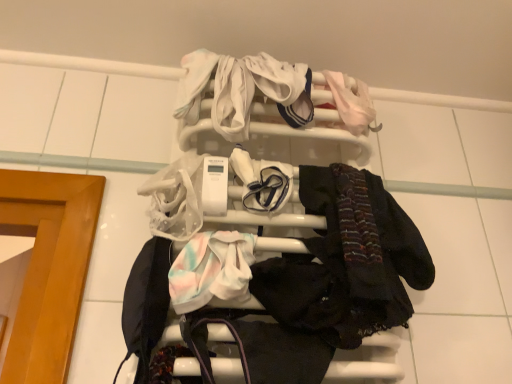
How much space does white soft fabric at center, the 2th baby clothe when ordered from left to right, occupy vertically?

The height of white soft fabric at center, the 2th baby clothe when ordered from left to right, is 4.92 inches.

What is the approximate height of dark matte scarf at center right?

11.28 inches.

Identify the location of dark matte scarf at center right. (358, 255).

Identify the location of pastel tie-dye fabric at center, placed as the first baby clothe when sorted from left to right. (212, 269).

You are a GUI agent. You are given a task and a screenshot of the screen. Output one action in this format:
    pyautogui.click(x=<x>, y=<y>)
    Task: Click on the pale pink fabric at upper right, the third baby clothe from the left
    
    Given the screenshot: What is the action you would take?
    pyautogui.click(x=350, y=102)

Does point (272, 183) come farther from viewer compared to point (361, 90)?

No, (272, 183) is closer to viewer.

Is white soft fabric at center, which is the 2th baby clothe in top-to-bottom order, taller than pale pink fabric at upper right, arranged as the first baby clothe when viewed from the back?

No, white soft fabric at center, which is the 2th baby clothe in top-to-bottom order, is not taller than pale pink fabric at upper right, arranged as the first baby clothe when viewed from the back.

Is white soft fabric at center, which is the 2th baby clothe in top-to-bottom order, thinner than pale pink fabric at upper right, arranged as the first baby clothe when viewed from the back?

Yes, white soft fabric at center, which is the 2th baby clothe in top-to-bottom order, is thinner than pale pink fabric at upper right, arranged as the first baby clothe when viewed from the back.

Looking at their sizes, would you say pale pink fabric at upper right, the third baby clothe from the left, is wider or thinner than dark matte scarf at center right?

In the image, pale pink fabric at upper right, the third baby clothe from the left, appears to be more narrow than dark matte scarf at center right.

Is pale pink fabric at upper right, the third baby clothe from the left, turned away from dark matte scarf at center right?

No, pale pink fabric at upper right, the third baby clothe from the left, is not facing the opposite direction of dark matte scarf at center right.

Is pale pink fabric at upper right, which appears as the third baby clothe when ordered from the bottom, taller than dark matte scarf at center right?

In fact, pale pink fabric at upper right, which appears as the third baby clothe when ordered from the bottom, may be shorter than dark matte scarf at center right.

From the image's perspective, who appears lower, white plastic towel rack at upper center or pale pink fabric at upper right, which appears as the third baby clothe when ordered from the bottom?

white plastic towel rack at upper center.

How many degrees apart are the facing directions of white plastic towel rack at upper center and pale pink fabric at upper right, the 3th baby clothe when ordered from front to back?

0.000335 degrees.

Could you measure the distance between white plastic towel rack at upper center and pale pink fabric at upper right, the third baby clothe from the left?

white plastic towel rack at upper center and pale pink fabric at upper right, the third baby clothe from the left, are 9.69 inches apart from each other.

Is white plastic towel rack at upper center positioned with its back to pale pink fabric at upper right, the 3th baby clothe when ordered from front to back?

Yes, white plastic towel rack at upper center is facing away from pale pink fabric at upper right, the 3th baby clothe when ordered from front to back.

In terms of height, does pastel tie-dye fabric at center, the 1th baby clothe from the front, look taller or shorter compared to white soft fabric at center, which is the 2th baby clothe in top-to-bottom order?

pastel tie-dye fabric at center, the 1th baby clothe from the front, is shorter than white soft fabric at center, which is the 2th baby clothe in top-to-bottom order.

Can you tell me how much pastel tie-dye fabric at center, the third baby clothe in the right-to-left sequence, and white soft fabric at center, the 2th baby clothe when ordered from left to right, differ in facing direction?

pastel tie-dye fabric at center, the third baby clothe in the right-to-left sequence, and white soft fabric at center, the 2th baby clothe when ordered from left to right, are facing 7.3e-05 degrees away from each other.

From the image's perspective, would you say pastel tie-dye fabric at center, marked as the first baby clothe in a bottom-to-top arrangement, is positioned over white soft fabric at center, acting as the 2th baby clothe starting from the right?

Incorrect, from the image's perspective, pastel tie-dye fabric at center, marked as the first baby clothe in a bottom-to-top arrangement, is lower than white soft fabric at center, acting as the 2th baby clothe starting from the right.

Between pastel tie-dye fabric at center, the 3th baby clothe viewed from the top, and white soft fabric at center, which appears as the second baby clothe when viewed from the front, which one has smaller width?

white soft fabric at center, which appears as the second baby clothe when viewed from the front.

From the image's perspective, is dark matte scarf at center right beneath white plastic towel rack at upper center?

Yes.

From a real-world perspective, is dark matte scarf at center right over white plastic towel rack at upper center?

No.

Is dark matte scarf at center right next to white plastic towel rack at upper center?

Yes, dark matte scarf at center right is with white plastic towel rack at upper center.

Who is bigger, dark matte scarf at center right or white plastic towel rack at upper center?

Bigger between the two is white plastic towel rack at upper center.

Is pale pink fabric at upper right, arranged as the first baby clothe when viewed from the back, taller than white soft fabric at center, which is the 2th baby clothe in top-to-bottom order?

Correct, pale pink fabric at upper right, arranged as the first baby clothe when viewed from the back, is much taller as white soft fabric at center, which is the 2th baby clothe in top-to-bottom order.

Where is `baby clothe above the white soft fabric at center, the 2th baby clothe from the bottom (from the image's perspective)`? This screenshot has width=512, height=384. baby clothe above the white soft fabric at center, the 2th baby clothe from the bottom (from the image's perspective) is located at coordinates (350, 102).

Looking at this image, which point is more forward, (347, 94) or (251, 163)?

The point (251, 163) is more forward.

Can you tell me how much pale pink fabric at upper right, the first baby clothe in the right-to-left sequence, and white soft fabric at center, the 2th baby clothe when ordered from left to right, differ in facing direction?

They differ by 9.13e-05 degrees in their facing directions.

Is point (187, 172) closer or farther from the camera than point (232, 241)?

Point (187, 172) appears to be farther away from the viewer than point (232, 241).

Is pastel tie-dye fabric at center, the third baby clothe in the right-to-left sequence, at the back of white plastic towel rack at upper center?

Absolutely, white plastic towel rack at upper center is directed away from pastel tie-dye fabric at center, the third baby clothe in the right-to-left sequence.

Which is more to the left, white plastic towel rack at upper center or pastel tie-dye fabric at center, marked as the first baby clothe in a bottom-to-top arrangement?

pastel tie-dye fabric at center, marked as the first baby clothe in a bottom-to-top arrangement.

Which is correct: white plastic towel rack at upper center is inside pastel tie-dye fabric at center, the 3th baby clothe viewed from the top, or outside of it?

white plastic towel rack at upper center lies outside pastel tie-dye fabric at center, the 3th baby clothe viewed from the top.

This screenshot has width=512, height=384. In order to click on baby clothe that is the 1st object to the left of the pale pink fabric at upper right, arranged as the first baby clothe when viewed from the back, starting at the anchor in this screenshot , I will do `click(262, 182)`.

The height and width of the screenshot is (384, 512). Identify the location of clothing in front of the pale pink fabric at upper right, the first baby clothe in the right-to-left sequence. (358, 255).

From the image, which object appears to be nearer to dark matte scarf at center right, white plastic towel rack at upper center or pastel tie-dye fabric at center, the third baby clothe in the right-to-left sequence?

The object closer to dark matte scarf at center right is white plastic towel rack at upper center.

When comparing their distances from dark matte scarf at center right, does pale pink fabric at upper right, the first baby clothe in the right-to-left sequence, or white plastic towel rack at upper center seem further?

pale pink fabric at upper right, the first baby clothe in the right-to-left sequence, is further to dark matte scarf at center right.

From the image, which object appears to be nearer to white soft fabric at center, which appears as the second baby clothe when viewed from the front, pale pink fabric at upper right, which appears as the third baby clothe when ordered from the bottom, or dark matte scarf at center right?

dark matte scarf at center right is positioned closer to the anchor white soft fabric at center, which appears as the second baby clothe when viewed from the front.

Estimate the real-world distances between objects in this image. Which object is further from white plastic towel rack at upper center, pastel tie-dye fabric at center, the third baby clothe in the right-to-left sequence, or white soft fabric at center, acting as the 2th baby clothe starting from the right?

Based on the image, white soft fabric at center, acting as the 2th baby clothe starting from the right, appears to be further to white plastic towel rack at upper center.

Which object lies further to the anchor point pastel tie-dye fabric at center, the 3th baby clothe viewed from the top, white soft fabric at center, the 2th baby clothe when ordered from left to right, or dark matte scarf at center right?

dark matte scarf at center right is further to pastel tie-dye fabric at center, the 3th baby clothe viewed from the top.

Which object lies further to the anchor point white plastic towel rack at upper center, pale pink fabric at upper right, the first baby clothe in the right-to-left sequence, or pastel tie-dye fabric at center, placed as the first baby clothe when sorted from left to right?

pale pink fabric at upper right, the first baby clothe in the right-to-left sequence, is further to white plastic towel rack at upper center.

Considering their positions, is white plastic towel rack at upper center positioned further to dark matte scarf at center right than white soft fabric at center, which appears as the second baby clothe when viewed from the front?

white soft fabric at center, which appears as the second baby clothe when viewed from the front, lies further to dark matte scarf at center right than the other object.

When comparing their distances from pastel tie-dye fabric at center, the 3th baby clothe viewed from the top, does white soft fabric at center, which is the 2th baby clothe in top-to-bottom order, or white plastic towel rack at upper center seem closer?

white soft fabric at center, which is the 2th baby clothe in top-to-bottom order, is positioned closer to the anchor pastel tie-dye fabric at center, the 3th baby clothe viewed from the top.

I want to click on baby clothe that lies between pale pink fabric at upper right, the first baby clothe in the right-to-left sequence, and white plastic towel rack at upper center from top to bottom, so click(262, 182).

What are the coordinates of `bunk bed between white soft fabric at center, acting as the 2th baby clothe starting from the right, and pastel tie-dye fabric at center, the 3th baby clothe viewed from the top, from top to bottom` in the screenshot? It's located at (266, 240).

The height and width of the screenshot is (384, 512). Identify the location of bunk bed between pale pink fabric at upper right, arranged as the first baby clothe when viewed from the back, and pastel tie-dye fabric at center, placed as the first baby clothe when sorted from left to right, vertically. (266, 240).

Locate an element on the screen. bunk bed located between pastel tie-dye fabric at center, the 1th baby clothe from the front, and dark matte scarf at center right in the left-right direction is located at coordinates (266, 240).